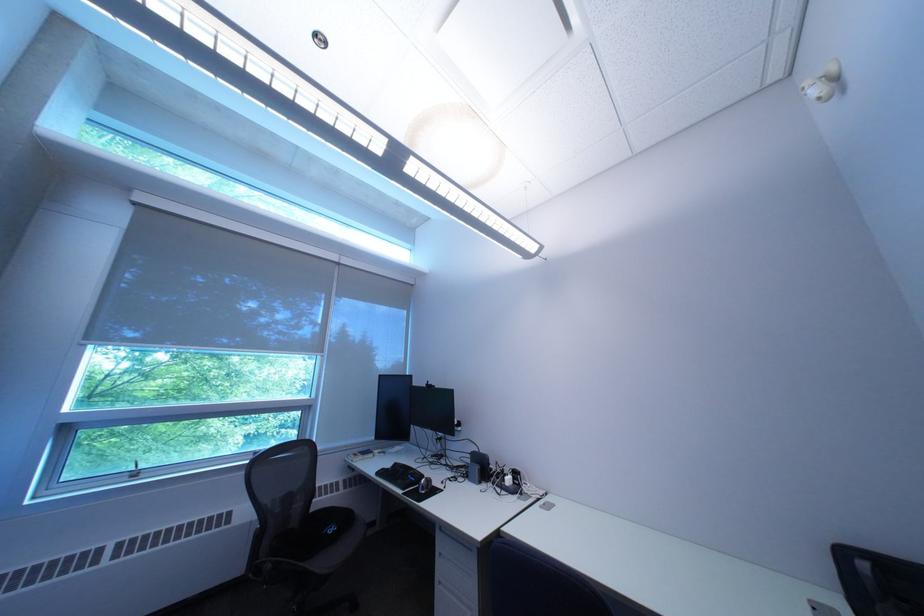
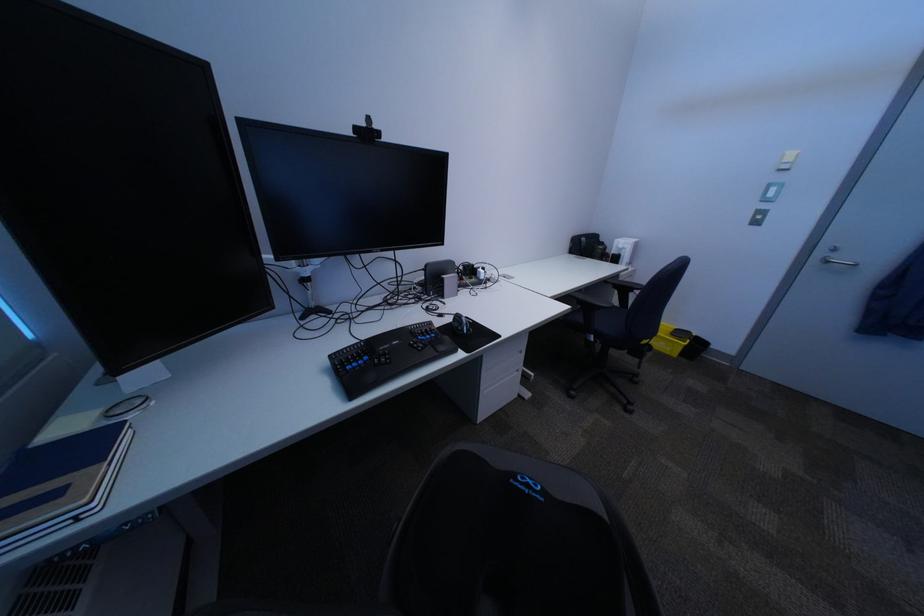
Find the pixel in the second image that matches (442,387) in the first image.

(371, 131)